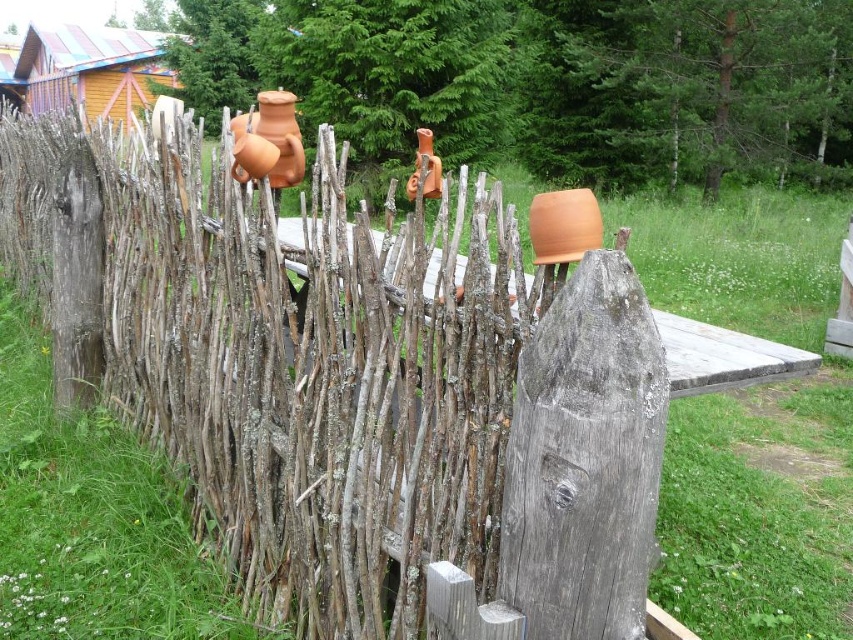
You are standing in front of the rustic wooden fence with two points marked on it. The first point is at coordinates point (26, 97) and the second is at point (270, 115). Which point is closer to you?

Point (26, 97) is closer to you because it is further to the camera than point (270, 115).